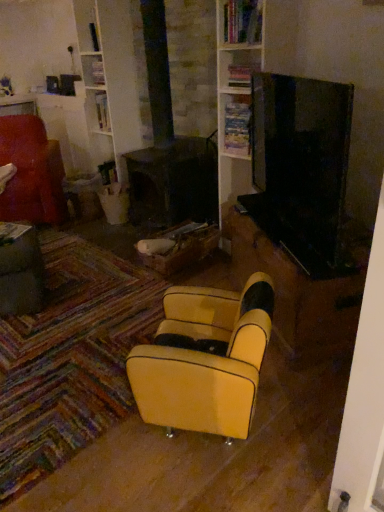
In order to click on unoccupied space behind metallic gray table at lower left in this screenshot , I will do `click(70, 259)`.